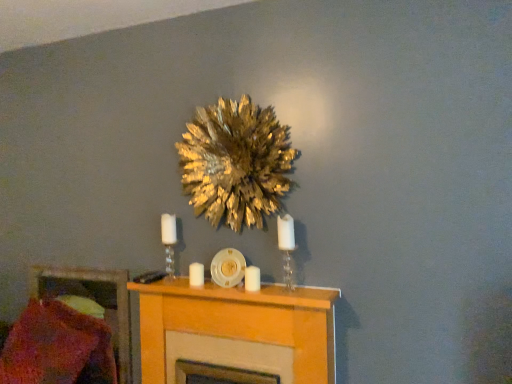
This screenshot has height=384, width=512. What are the coordinates of `free spot in front of white glass candle holder at center, which ranks as the 2th candle holder in right-to-left order` in the screenshot? It's located at (168, 288).